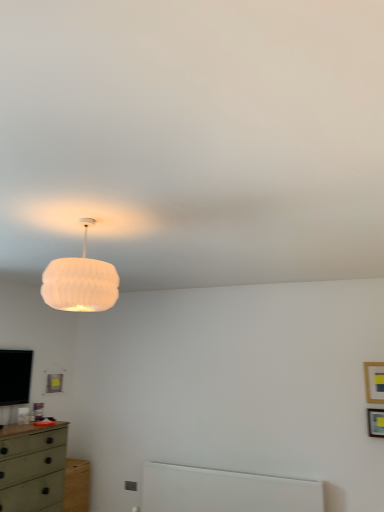
Question: Would you say white ribbed shade at upper center is inside or outside green matte chest of drawers at lower left?

Choices:
 (A) inside
 (B) outside

Answer: (B)

Question: From their relative heights in the image, would you say white ribbed shade at upper center is taller or shorter than green matte chest of drawers at lower left?

Choices:
 (A) tall
 (B) short

Answer: (B)

Question: Estimate the real-world distances between objects in this image. Which object is closer to the green matte chest of drawers at lower left?

Choices:
 (A) white ribbed shade at upper center
 (B) wooden picture frame at upper right, the 2th picture frame ordered from the bottom
 (C) wooden picture frame at upper right, which appears as the second picture frame when viewed from the top

Answer: (A)

Question: Which object is positioned farthest from the green matte chest of drawers at lower left?

Choices:
 (A) wooden picture frame at upper right, which is the first picture frame from top to bottom
 (B) white ribbed shade at upper center
 (C) wooden picture frame at upper right, positioned as the first picture frame in bottom-to-top order

Answer: (A)